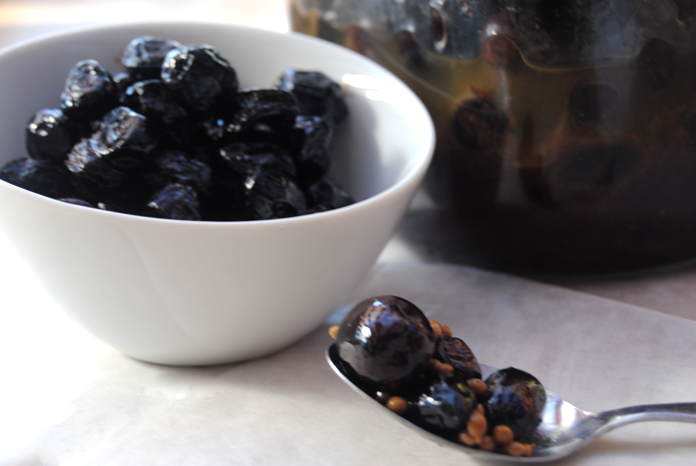
You are a GUI agent. You are given a task and a screenshot of the screen. Output one action in this format:
    pyautogui.click(x=<x>, y=<y>)
    Task: Click on the bowl
    This screenshot has width=696, height=466.
    Given the screenshot: What is the action you would take?
    pyautogui.click(x=134, y=283)